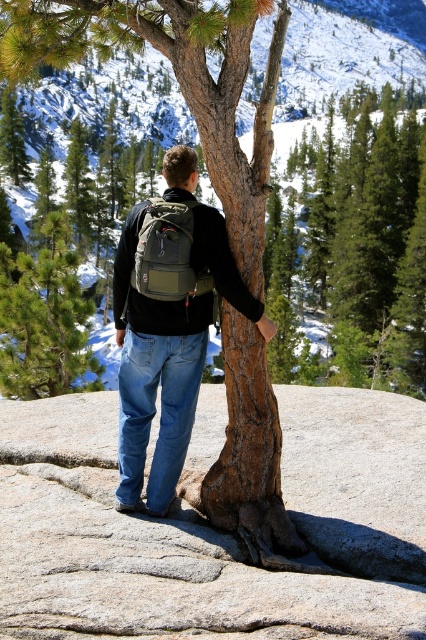
Question: Estimate the real-world distances between objects in this image. Which object is farther from the olive green fabric backpack at center?

Choices:
 (A) rough textured rock at center
 (B) denim jeans at center
 (C) green textured pine tree at center

Answer: (C)

Question: Is rough textured rock at center smaller than denim jeans at center?

Choices:
 (A) yes
 (B) no

Answer: (A)

Question: Is green textured pine tree at center positioned in front of olive green fabric backpack at center?

Choices:
 (A) no
 (B) yes

Answer: (A)

Question: Is denim jeans at center above green textured pine tree at center?

Choices:
 (A) no
 (B) yes

Answer: (A)

Question: Which point appears farthest from the camera in this image?

Choices:
 (A) (198, 291)
 (B) (32, 269)
 (C) (180, 260)
 (D) (52, 577)

Answer: (B)

Question: Among these points, which one is nearest to the camera?

Choices:
 (A) (149, 240)
 (B) (420, 624)

Answer: (B)